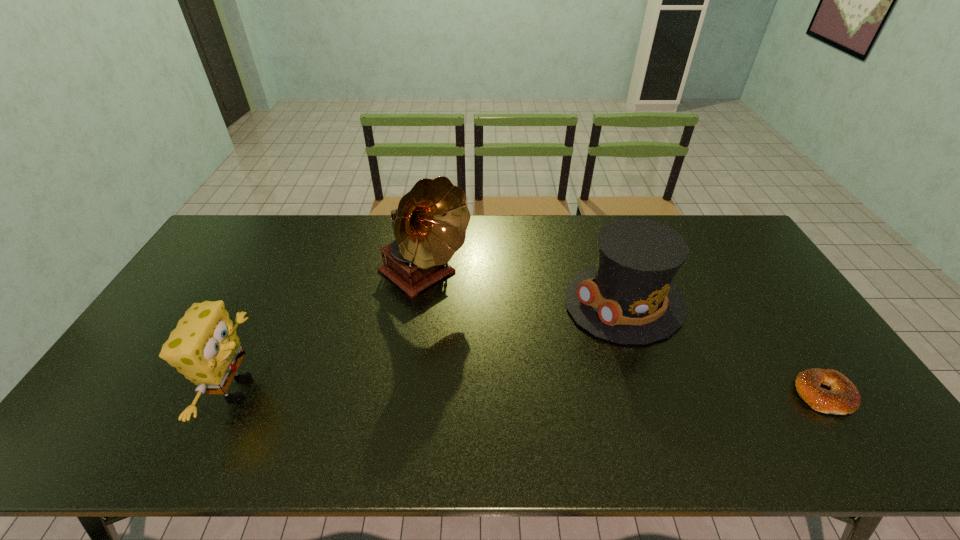
Locate an element on the screen. free space located 0.250m on the horn of the phonograph_record is located at coordinates (514, 347).

The image size is (960, 540). Identify the location of vacant space located with goggles on the front of the dress hat. (564, 330).

The height and width of the screenshot is (540, 960). Identify the location of free spot located with goggles on the front of the dress hat. (520, 350).

You are a GUI agent. You are given a task and a screenshot of the screen. Output one action in this format:
    pyautogui.click(x=<x>, y=<y>)
    Task: Click on the free space located 0.200m with goggles on the front of the dress hat
    The height and width of the screenshot is (540, 960).
    Given the screenshot: What is the action you would take?
    pyautogui.click(x=520, y=350)

At what (x,y) coordinates should I click in order to perform the action: click on object at the far edge. Please return your answer as a coordinate pair (x, y). Image resolution: width=960 pixels, height=540 pixels. Looking at the image, I should click on pyautogui.click(x=430, y=223).

This screenshot has width=960, height=540. Find the location of `sponge at the near edge`. sponge at the near edge is located at coordinates (204, 347).

At what (x,y) coordinates should I click in order to perform the action: click on bagel that is at the near edge. Please return your answer as a coordinate pair (x, y). The image size is (960, 540). Looking at the image, I should click on (843, 398).

Find the location of `object situated at the right edge`. object situated at the right edge is located at coordinates (843, 398).

Find the location of a particular element. The image size is (960, 540). object situated at the near right corner is located at coordinates (843, 398).

In the image, there is a desktop. Identify the location of vacant space at the far edge. The width and height of the screenshot is (960, 540). (286, 248).